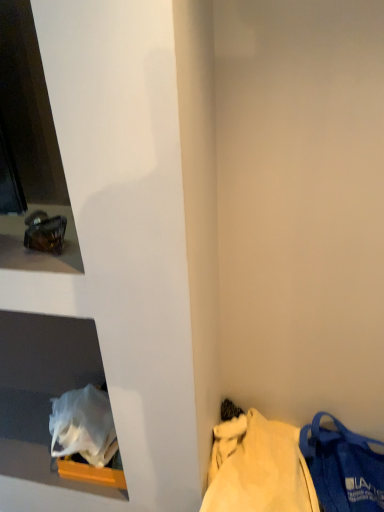
I want to click on free spot above white plastic bag at lower left (from a real-world perspective), so click(x=29, y=434).